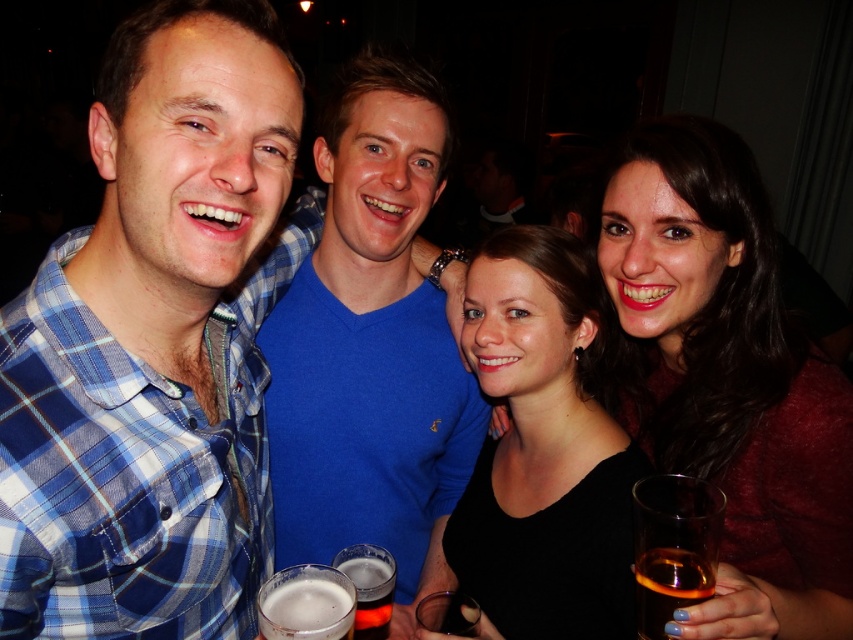
You are a photographer at the event and need to capture the blue cotton shirt at center and the clear plastic cup at lower center in the same frame. Which object will occupy more space in the photo?

The blue cotton shirt at center is bigger than the clear plastic cup at lower center, so it will occupy more space in the photo.

Based on the provided scene description, can you determine the spatial relationship between the blue cotton shirt at center and any other objects mentioned in the scene?

The blue cotton shirt at center is positioned at coordinates point (372, 346), but without additional object coordinates from the scene description, I cannot determine its spatial relationship to other objects.

You are a photographer at the event and want to capture a closeup of the blue cotton shirt at center without the clear plastic cup at lower center blocking the view. Is it possible to do so?

The blue cotton shirt at center is further to the viewer than the clear plastic cup at lower center, so the cup is behind the shirt and won